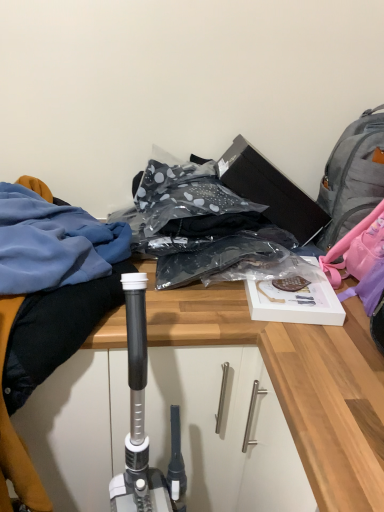
Measure the distance between point (46, 477) and camera.

Point (46, 477) is 1.10 meters from camera.

From the picture: What is the approximate height of wooden desk at center?

It is 77.63 centimeters.

The image size is (384, 512). Find the location of `blue fabric at left`. blue fabric at left is located at coordinates (45, 359).

Where is `wooden desk at center`? This screenshot has width=384, height=512. wooden desk at center is located at coordinates (297, 382).

Does blue fabric at left have a larger size compared to wooden desk at center?

Correct, blue fabric at left is larger in size than wooden desk at center.

Relative to wooden desk at center, is blue fabric at left in front or behind?

Clearly, blue fabric at left is behind wooden desk at center.

In the scene shown: Visually, is blue fabric at left positioned to the left or to the right of wooden desk at center?

From the image, it's evident that blue fabric at left is to the left of wooden desk at center.

Does point (80, 309) lie behind point (122, 371)?

That is False.

Based on the photo, is gray fabric backpack at upper right facing away from blue fabric at left?

gray fabric backpack at upper right does not have its back to blue fabric at left.

From a real-world perspective, relative to blue fabric at left, is gray fabric backpack at upper right vertically above or below?

In terms of real-world spatial position, gray fabric backpack at upper right is above blue fabric at left.

In the scene shown: From the image's perspective, is gray fabric backpack at upper right below blue fabric at left?

No.

How different are the orientations of gray fabric backpack at upper right and blue fabric at left in degrees?

The angular difference between gray fabric backpack at upper right and blue fabric at left is 97.6 degrees.

Considering the sizes of wooden desk at center and blue fabric at left in the image, is wooden desk at center bigger or smaller than blue fabric at left?

In the image, wooden desk at center appears to be smaller than blue fabric at left.

The height and width of the screenshot is (512, 384). What are the coordinates of `desk that appears in front of the blue fabric at left` in the screenshot? It's located at (297, 382).

In the scene shown: Who is shorter, wooden desk at center or blue fabric at left?

Standing shorter between the two is blue fabric at left.

Is blue fabric at left positioned with its back to gray fabric backpack at upper right?

That's not correct — blue fabric at left is not looking away from gray fabric backpack at upper right.

How distant is blue fabric at left from gray fabric backpack at upper right?

blue fabric at left is 27.15 inches away from gray fabric backpack at upper right.

From the image's perspective, would you say blue fabric at left is positioned over gray fabric backpack at upper right?

No, from the image's perspective, blue fabric at left is not on top of gray fabric backpack at upper right.

Considering the relative sizes of blue fabric at left and gray fabric backpack at upper right in the image provided, is blue fabric at left shorter than gray fabric backpack at upper right?

No.

Is gray fabric backpack at upper right not within wooden desk at center?

Yes, gray fabric backpack at upper right is not within wooden desk at center.

Where is `backpack that appears above the wooden desk at center (from the image's perspective)`? backpack that appears above the wooden desk at center (from the image's perspective) is located at coordinates (353, 176).

Is gray fabric backpack at upper right to the left of wooden desk at center from the viewer's perspective?

No.

Is gray fabric backpack at upper right aimed at wooden desk at center?

No, gray fabric backpack at upper right is not turned towards wooden desk at center.

Would you say wooden desk at center is a long distance from gray fabric backpack at upper right?

Actually, wooden desk at center and gray fabric backpack at upper right are a little close together.

Is wooden desk at center looking in the opposite direction of gray fabric backpack at upper right?

No, wooden desk at center is not facing the opposite direction of gray fabric backpack at upper right.

Does point (90, 425) come behind point (355, 182)?

No, it is not.

This screenshot has height=512, width=384. What are the coordinates of `clothing behind the wooden desk at center` in the screenshot? It's located at (45, 359).

You are a GUI agent. You are given a task and a screenshot of the screen. Output one action in this format:
    pyautogui.click(x=<x>, y=<y>)
    Task: Click on the backpack on the right of blue fabric at left
    Image resolution: width=384 pixels, height=512 pixels.
    Given the screenshot: What is the action you would take?
    pyautogui.click(x=353, y=176)

Looking at the image, which one is located closer to gray fabric backpack at upper right, blue fabric at left or wooden desk at center?

The object closer to gray fabric backpack at upper right is wooden desk at center.

Considering their positions, is wooden desk at center positioned closer to blue fabric at left than gray fabric backpack at upper right?

Among the two, wooden desk at center is located nearer to blue fabric at left.

Which object lies nearer to the anchor point wooden desk at center, blue fabric at left or gray fabric backpack at upper right?

The object closer to wooden desk at center is blue fabric at left.

Considering their positions, is gray fabric backpack at upper right positioned closer to wooden desk at center than blue fabric at left?

Among the two, blue fabric at left is located nearer to wooden desk at center.

From the image, which object appears to be farther from blue fabric at left, gray fabric backpack at upper right or wooden desk at center?

The object further to blue fabric at left is gray fabric backpack at upper right.

Considering their positions, is wooden desk at center positioned further to gray fabric backpack at upper right than blue fabric at left?

Based on the image, blue fabric at left appears to be further to gray fabric backpack at upper right.

What are the coordinates of `desk between blue fabric at left and gray fabric backpack at upper right in the horizontal direction` in the screenshot? It's located at (297, 382).